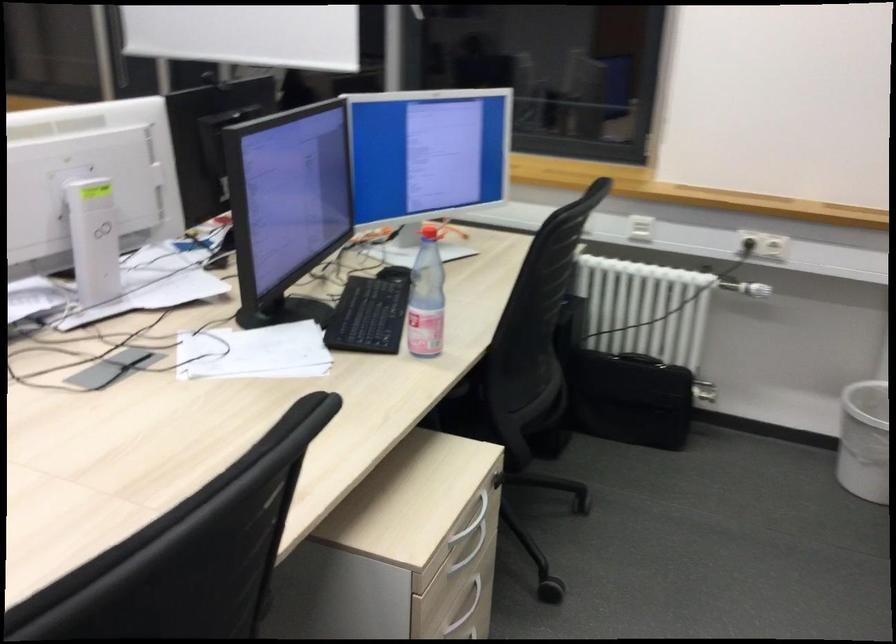
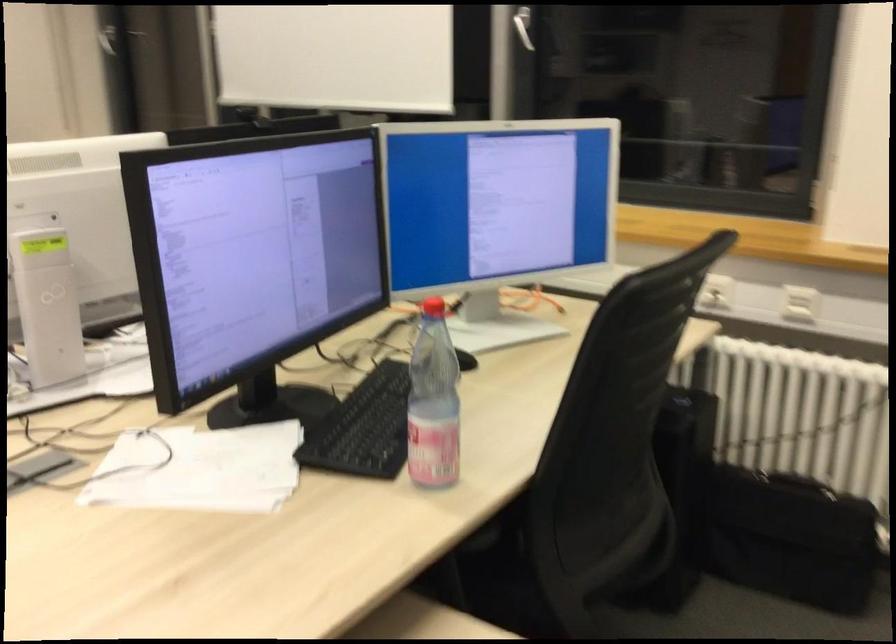
What movement of the cameraman would produce the second image?

The movement direction of the cameraman is right, forward.